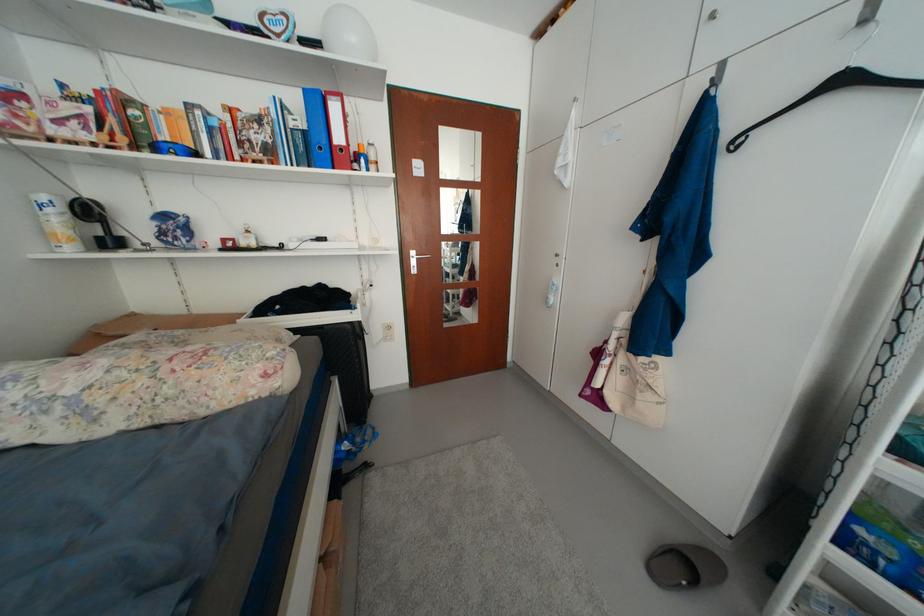
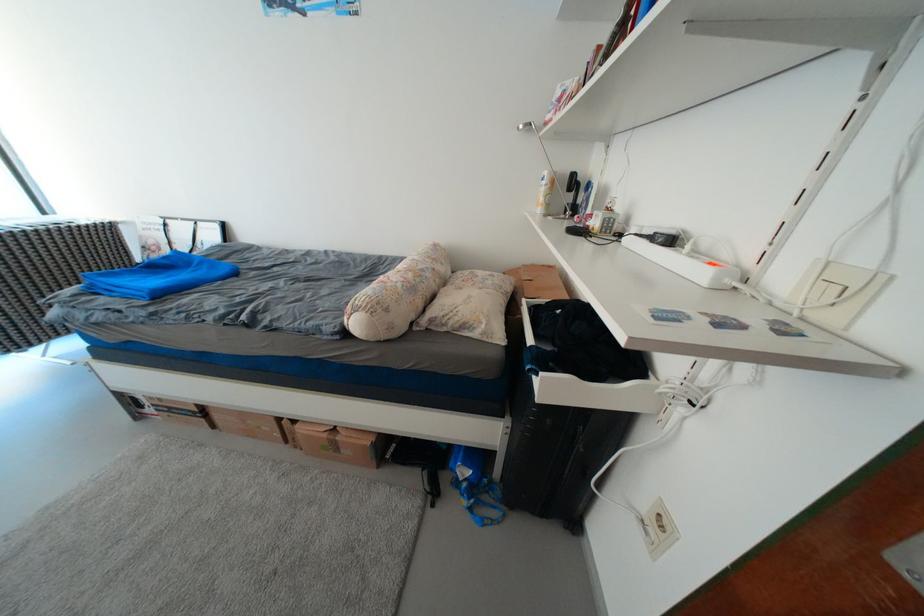
Where in the second image is the point corresponding to [59,213] from the first image?

(553, 185)